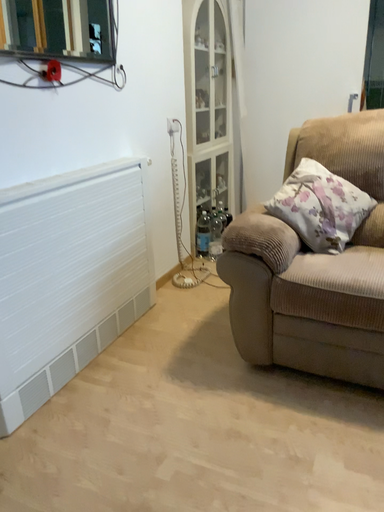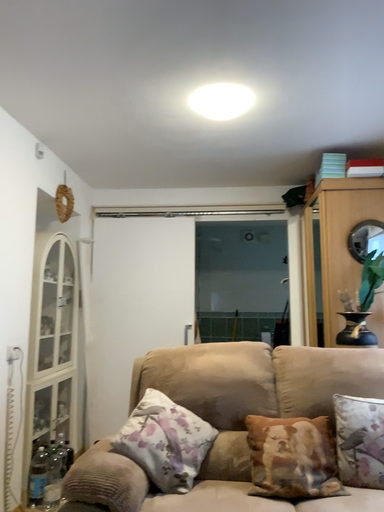
Question: How did the camera likely rotate when shooting the video?

Choices:
 (A) rotated downward
 (B) rotated upward

Answer: (B)